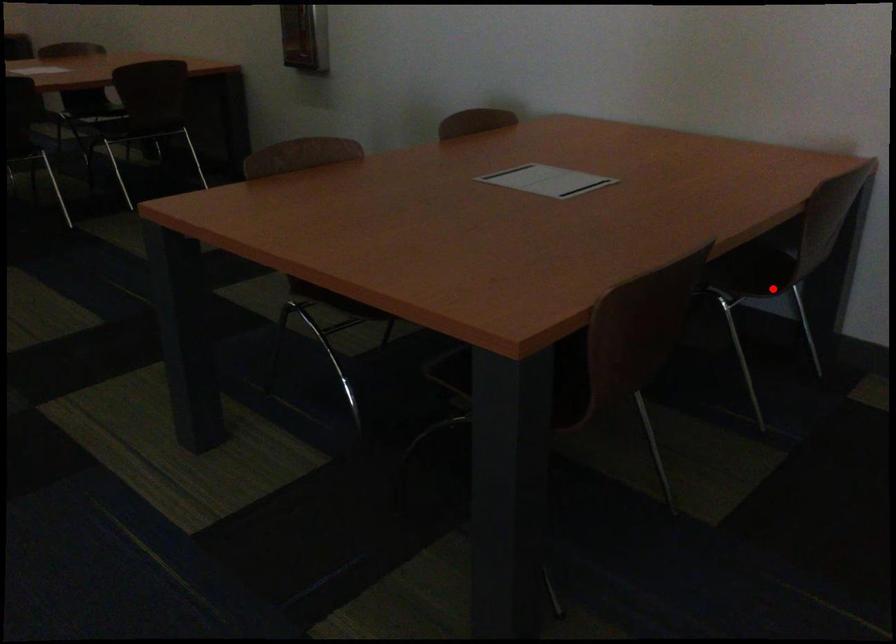
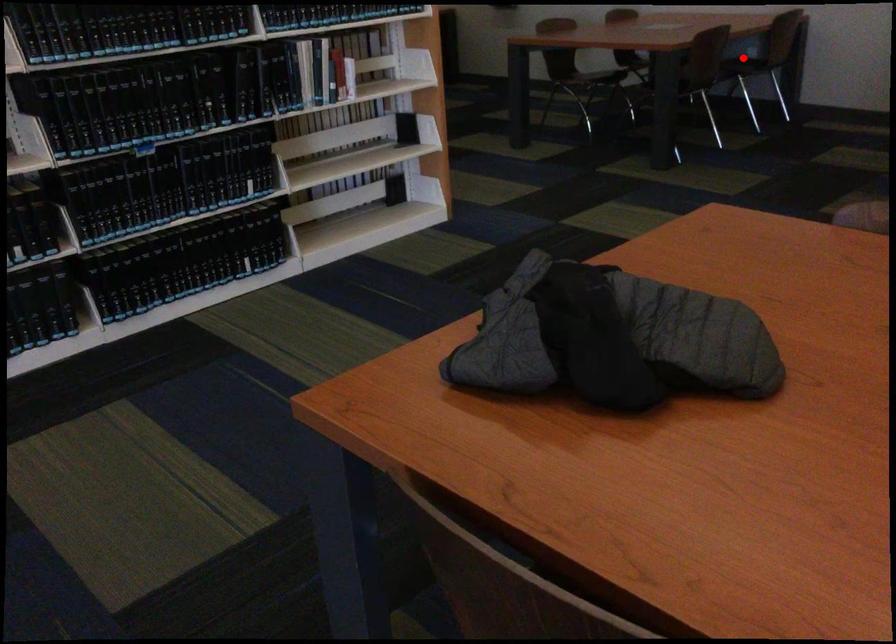
I am providing you with two images of the same scene from different viewpoints. A red point is marked on the first image and another point is marked on the second image. Is the marked point in image1 the same physical position as the marked point in image2?

Yes